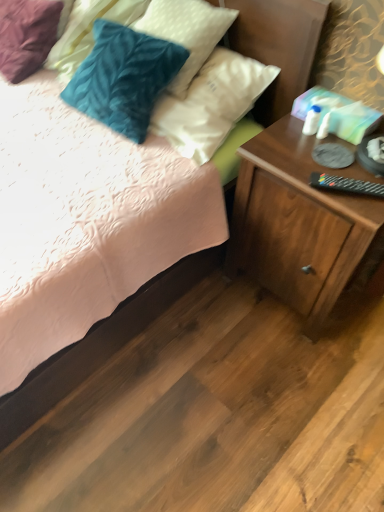
Question: Is point (72, 6) positioned closer to the camera than point (299, 144)?

Choices:
 (A) closer
 (B) farther

Answer: (B)

Question: In terms of size, does velvety teal pillow at upper left, the first pillow in the left-to-right sequence, appear bigger or smaller than wooden nightstand at lower right?

Choices:
 (A) small
 (B) big

Answer: (A)

Question: Which is nearer to the black plastic remote control at right?

Choices:
 (A) velvety blue pillow at upper left, the 2th pillow from the left
 (B) velvety teal pillow at upper left, the 2th pillow viewed from the right
 (C) wooden nightstand at lower right

Answer: (C)

Question: Estimate the real-world distances between objects in this image. Which object is farther from the wooden nightstand at lower right?

Choices:
 (A) velvety teal pillow at upper left, the first pillow in the left-to-right sequence
 (B) velvety blue pillow at upper left, which is the first pillow in right-to-left order
 (C) black plastic remote control at right

Answer: (A)